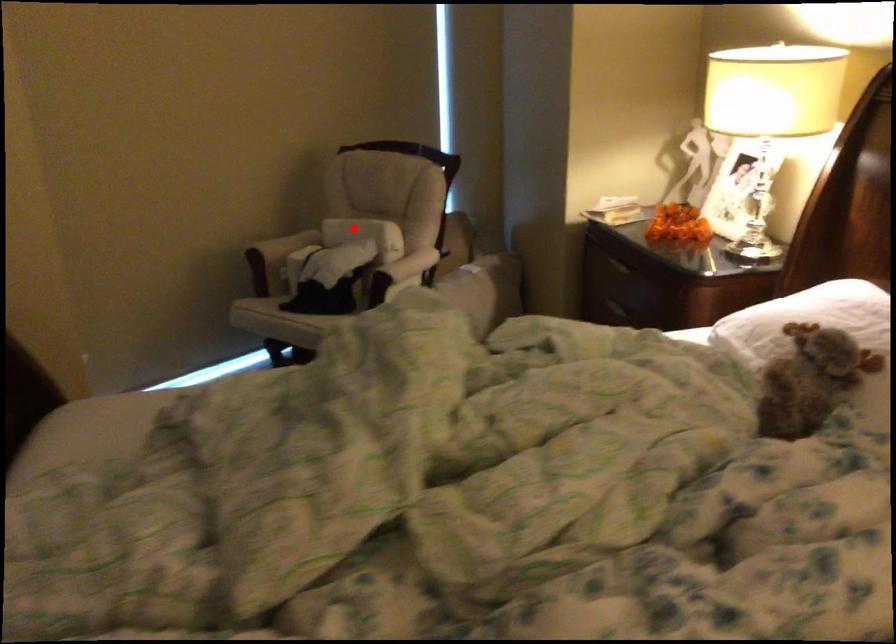
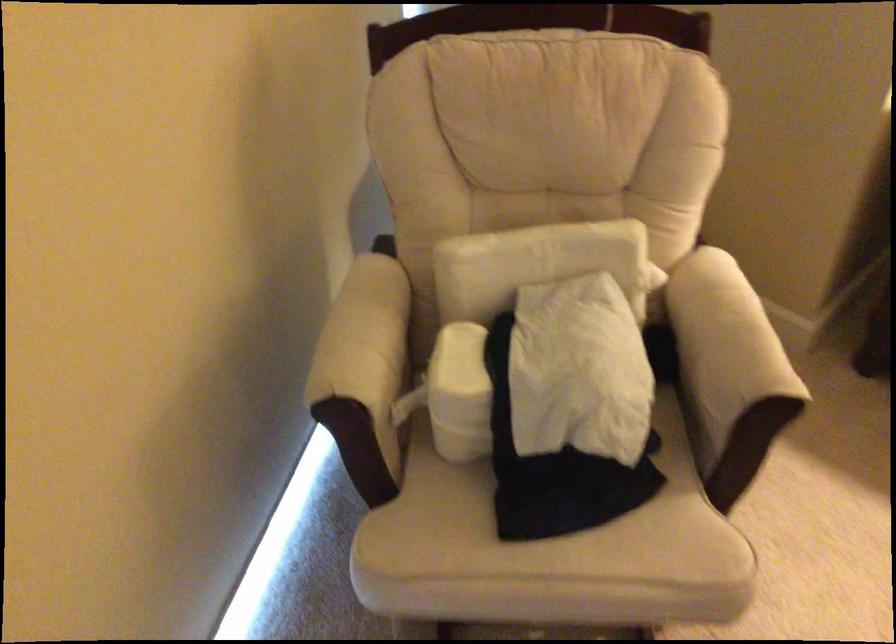
Question: I am providing you with two images of the same scene from different viewpoints. In image1, a red point is highlighted. Considering the same 3D point in image2, which of the following is correct?

Choices:
 (A) It is closer
 (B) It is farther

Answer: (A)